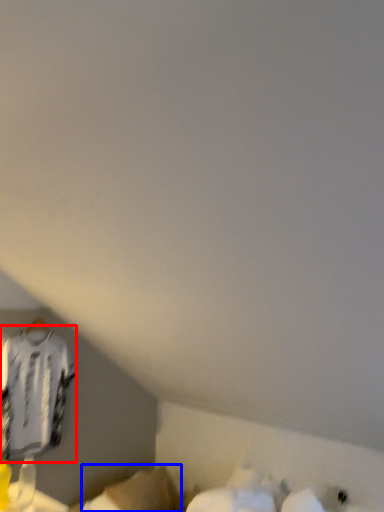
Question: Which point is closer to the camera, clothing (highlighted by a red box) or wide (highlighted by a blue box)?

Choices:
 (A) clothing
 (B) wide

Answer: (A)